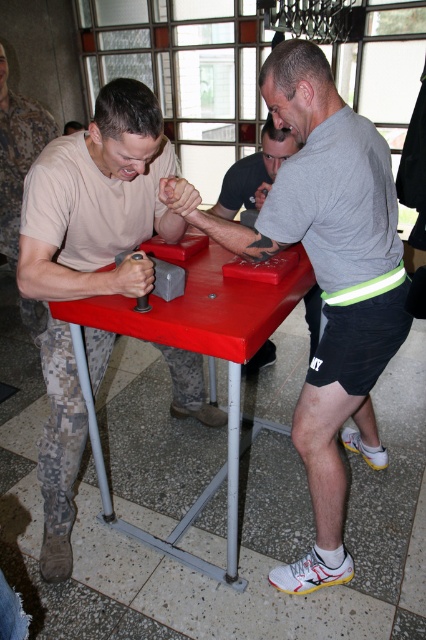
Question: Does red plastic table at center come behind gray matte arm at center?

Choices:
 (A) yes
 (B) no

Answer: (B)

Question: Can you confirm if red plastic table at center is positioned to the left of gray matte arm at center?

Choices:
 (A) yes
 (B) no

Answer: (A)

Question: Which object is positioned closest to the gray matte shirt at center?

Choices:
 (A) red plastic table at center
 (B) gray matte arm at center
 (C) camouflage uniform at left

Answer: (A)

Question: Among these objects, which one is nearest to the camera?

Choices:
 (A) red plastic table at center
 (B) camouflage uniform at left
 (C) gray matte shirt at center
 (D) gray matte arm at center

Answer: (A)

Question: Which point appears farthest from the camera in this image?

Choices:
 (A) (78, 262)
 (B) (302, 416)
 (C) (252, 186)
 (D) (278, 291)

Answer: (C)

Question: Does gray matte shirt at center have a lesser width compared to gray matte arm at center?

Choices:
 (A) yes
 (B) no

Answer: (B)